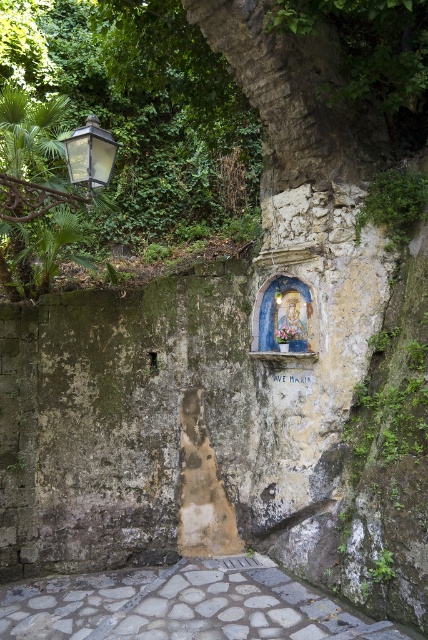
Question: Can you confirm if gray stone path at center is positioned above green leafy plant at upper right?

Choices:
 (A) no
 (B) yes

Answer: (A)

Question: Which of the following is the closest to the observer?

Choices:
 (A) (118, 144)
 (B) (47, 637)

Answer: (A)

Question: Which of the following is the farthest from the observer?

Choices:
 (A) (59, 596)
 (B) (388, 204)

Answer: (A)

Question: Is the position of gray stone path at center less distant than that of matte black lantern at upper left?

Choices:
 (A) no
 (B) yes

Answer: (A)

Question: Can you confirm if gray stone path at center is positioned to the right of green leafy plant at upper right?

Choices:
 (A) yes
 (B) no

Answer: (B)

Question: Which of the following is the farthest from the observer?

Choices:
 (A) [100, 154]
 (B) [389, 208]
 (C) [88, 625]

Answer: (B)